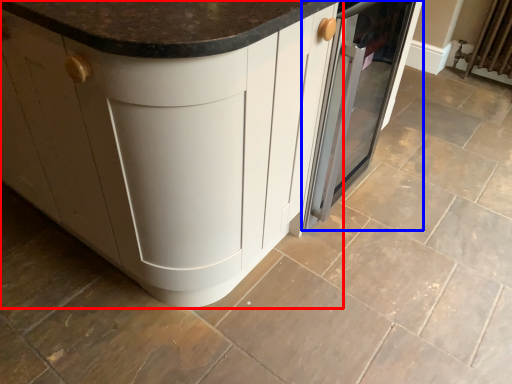
Question: Among these objects, which one is nearest to the camera, cabinetry (highlighted by a red box) or home appliance (highlighted by a blue box)?

Choices:
 (A) cabinetry
 (B) home appliance

Answer: (A)